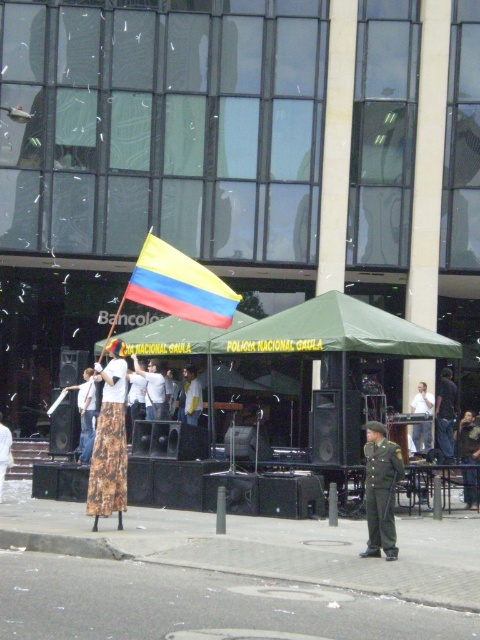
Question: Which point appears closest to the camera in this image?

Choices:
 (A) (159, 394)
 (B) (4, 458)

Answer: (B)

Question: In this image, where is yellow-red-blue fabric flag at center located relative to white cotton shirt at center?

Choices:
 (A) right
 (B) left

Answer: (B)

Question: Is printed fabric skirt at center thinner than green uniform at center?

Choices:
 (A) no
 (B) yes

Answer: (A)

Question: Which point is closer to the camera?

Choices:
 (A) floral skirt at center
 (B) green uniform at center

Answer: (B)

Question: Can you confirm if printed fabric skirt at center is thinner than light brown leather jacket at center?

Choices:
 (A) yes
 (B) no

Answer: (A)

Question: Which object is the closest to the dark blue uniform at center?

Choices:
 (A) printed fabric skirt at center
 (B) yellow-red-blue fabric flag at center

Answer: (B)